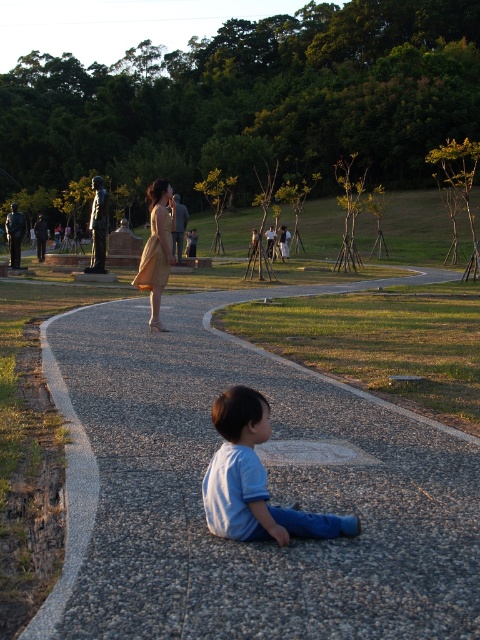
You are standing at the point marked by the coordinates [268,484] in the park. Looking around, you notice a gray gravel path at lower center. Which direction should you walk to reach the paved circular path in the midground?

The gray gravel path at lower center is located at the coordinates [268,484]. To reach the paved circular path in the midground, you should walk northward along the gray gravel path at lower center since it curves towards the midground where the paved path is located.

You are a photographer wanting to capture both the matte beige dress at center and the light beige fabric dress at center in a single frame. Which dress should you focus on first to ensure both are in the frame?

The matte beige dress at center is much taller than the light beige fabric dress at center, so you should focus on the matte beige dress at center first to ensure both are in the frame.